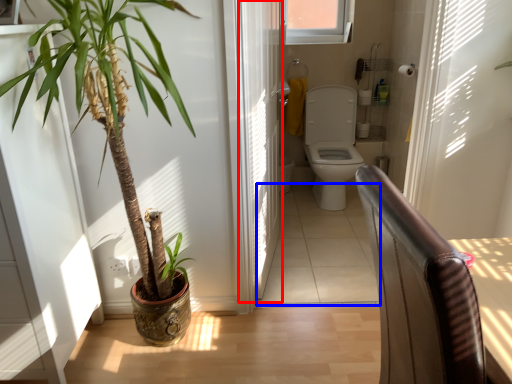
Question: Which point is closer to the camera, screen door (highlighted by a red box) or path (highlighted by a blue box)?

Choices:
 (A) screen door
 (B) path

Answer: (A)